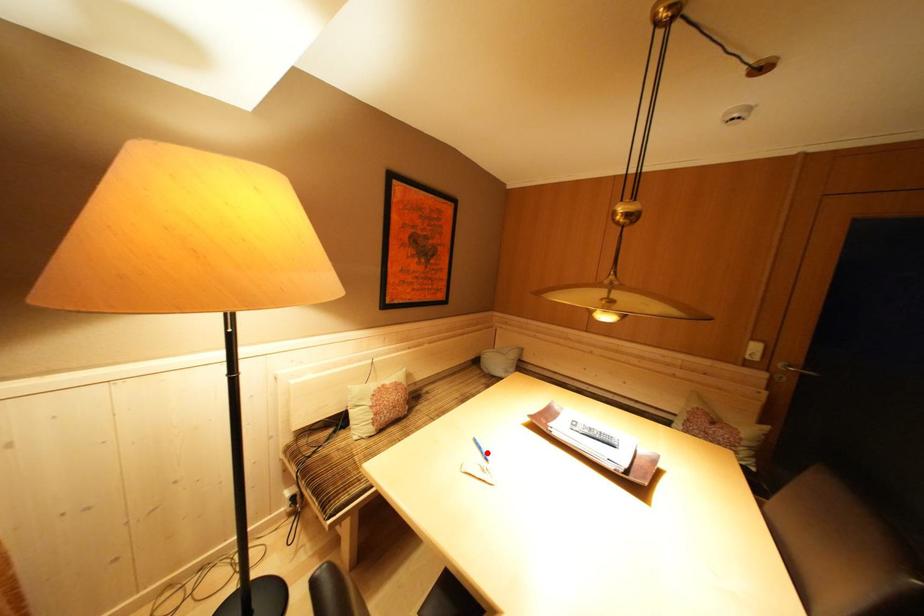
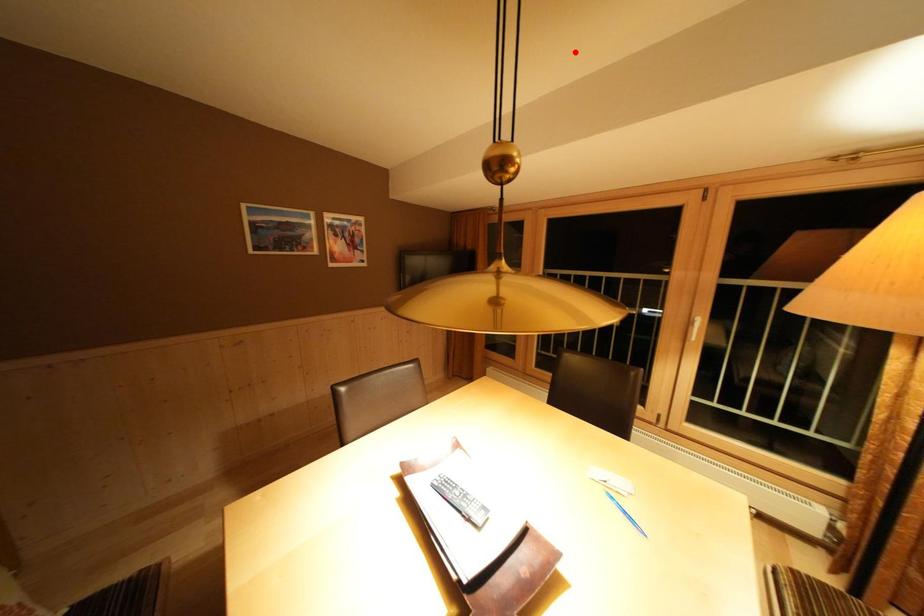
I am providing you with two images of the same scene from different viewpoints. A red point is marked on the first image and another point is marked on the second image. Is the marked point in image1 the same physical position as the marked point in image2?

No